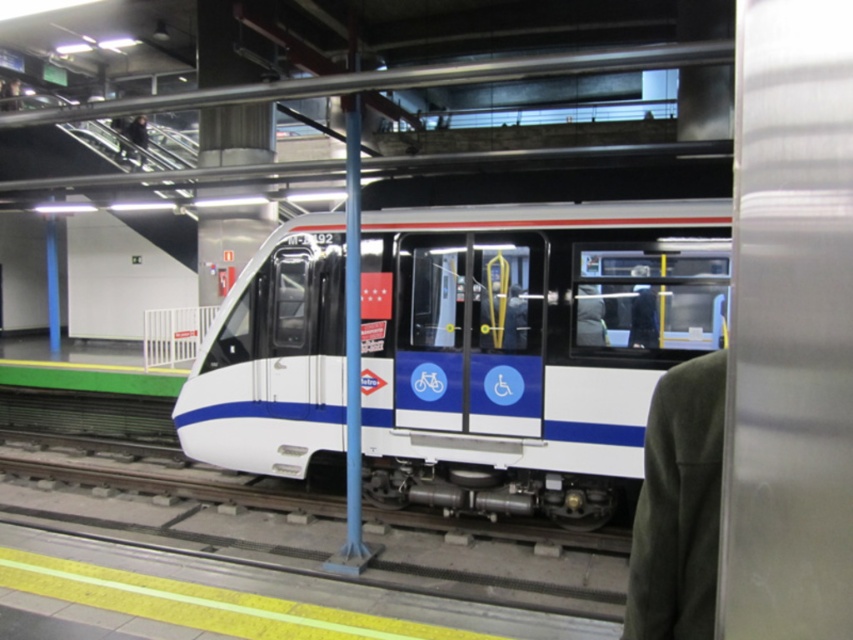
Is white glossy train at center thinner than green wool coat at right?

Incorrect, white glossy train at center's width is not less than green wool coat at right's.

Between white glossy train at center and green wool coat at right, which one has less height?

Standing shorter between the two is green wool coat at right.

You are a GUI agent. You are given a task and a screenshot of the screen. Output one action in this format:
    pyautogui.click(x=<x>, y=<y>)
    Task: Click on the white glossy train at center
    The height and width of the screenshot is (640, 853).
    Given the screenshot: What is the action you would take?
    pyautogui.click(x=526, y=348)

Is green wool coat at right positioned behind dark gray suit at center?

That is False.

Can you confirm if green wool coat at right is taller than dark gray suit at center?

Incorrect, green wool coat at right's height is not larger of dark gray suit at center's.

This screenshot has width=853, height=640. Identify the location of green wool coat at right. (677, 506).

Is the position of white glossy train at center less distant than that of dark gray suit at center?

Yes, it is.

Which is in front, point (265, 362) or point (645, 339)?

Point (645, 339)

Who is more distant from viewer, (624, 232) or (650, 333)?

Point (624, 232)

The width and height of the screenshot is (853, 640). Find the location of `white glossy train at center`. white glossy train at center is located at coordinates (526, 348).